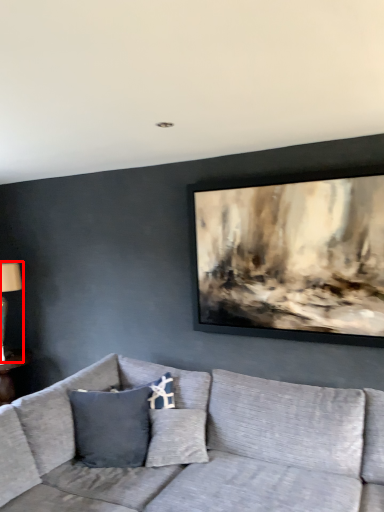
Question: From the image's perspective, what is the correct spatial positioning of table lamp (annotated by the red box) in reference to studio couch?

Choices:
 (A) below
 (B) above

Answer: (B)